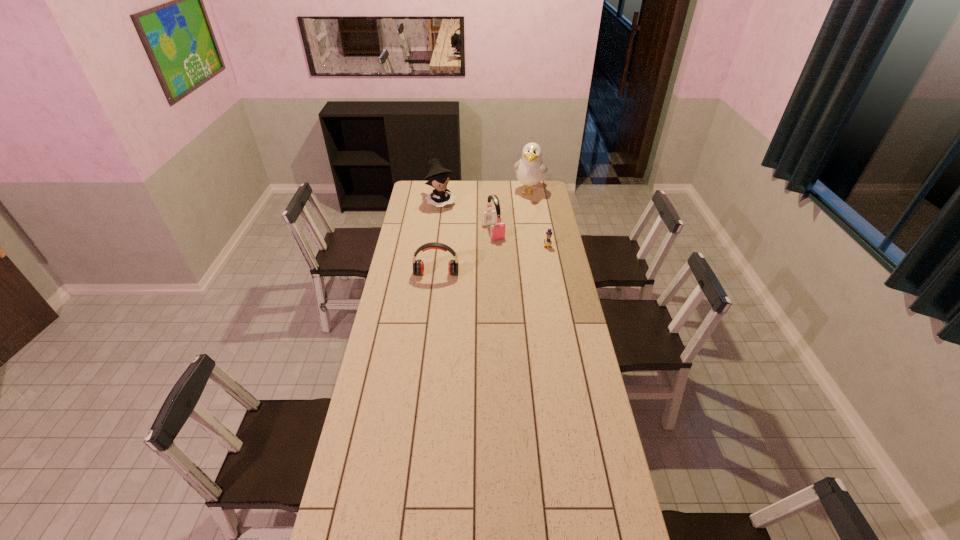
Where is `the shorter earphone`? Image resolution: width=960 pixels, height=540 pixels. the shorter earphone is located at coordinates (418, 266).

Image resolution: width=960 pixels, height=540 pixels. I want to click on the nearest object, so click(x=418, y=266).

Locate an element on the screen. the fourth farthest object is located at coordinates (548, 242).

The width and height of the screenshot is (960, 540). In order to click on the shortest object in this screenshot , I will do `click(548, 242)`.

Identify the location of the tallest object. The width and height of the screenshot is (960, 540). (530, 170).

The width and height of the screenshot is (960, 540). I want to click on doll, so click(x=438, y=177).

You are a GUI agent. You are given a task and a screenshot of the screen. Output one action in this format:
    pyautogui.click(x=<x>, y=<y>)
    Task: Click on the third shortest object
    The height and width of the screenshot is (540, 960).
    Given the screenshot: What is the action you would take?
    pyautogui.click(x=489, y=217)

Locate an element on the screen. This screenshot has width=960, height=540. the third object from left to right is located at coordinates (489, 217).

Where is `vacant space located on the ear cups of the nearer earphone`? vacant space located on the ear cups of the nearer earphone is located at coordinates (433, 307).

You are a GUI agent. You are given a task and a screenshot of the screen. Output one action in this format:
    pyautogui.click(x=<x>, y=<y>)
    Task: Click on the free space located on the face of the duckling, where the monocle is placed
    This screenshot has height=540, width=960.
    Given the screenshot: What is the action you would take?
    pyautogui.click(x=557, y=298)